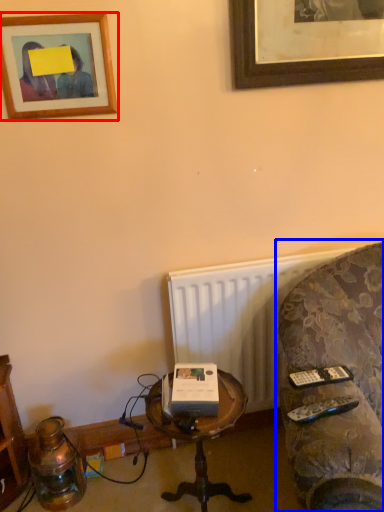
Question: Which object appears closest to the camera in this image, picture frame (highlighted by a red box) or studio couch (highlighted by a blue box)?

Choices:
 (A) picture frame
 (B) studio couch

Answer: (B)